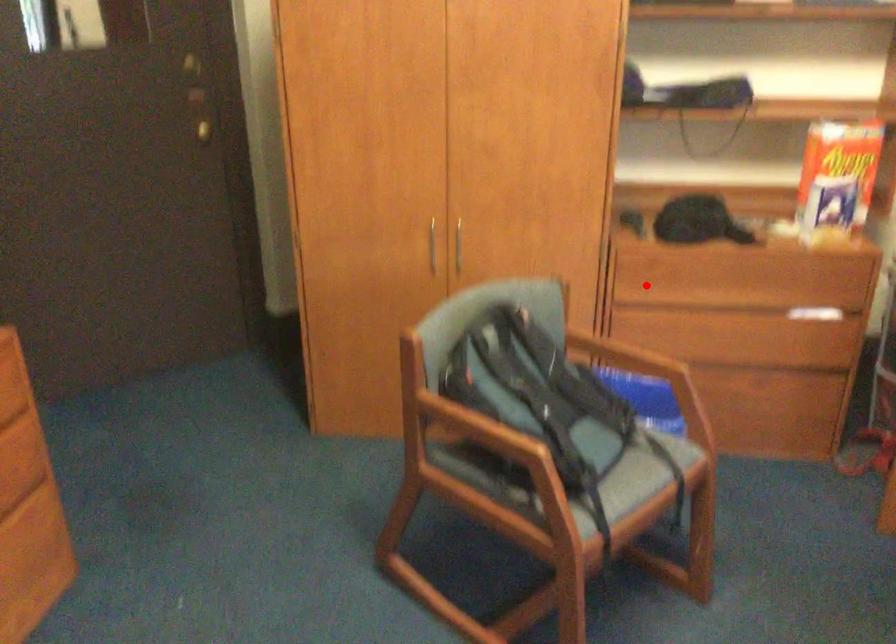
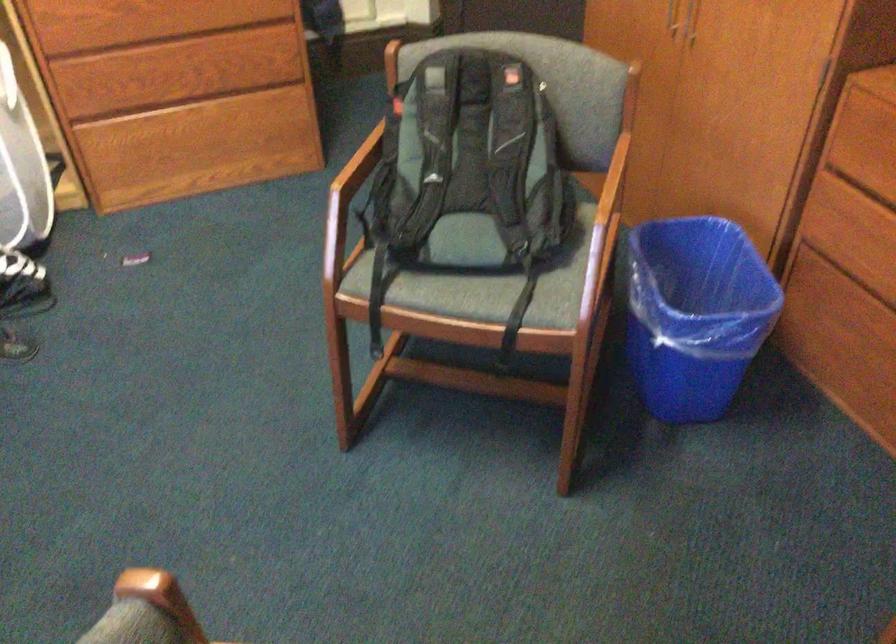
Question: I am providing you with two images of the same scene from different viewpoints. A red point is shown in image1. For the corresponding object point in image2, is it positioned nearer or farther from the camera?

Choices:
 (A) Nearer
 (B) Farther

Answer: (A)